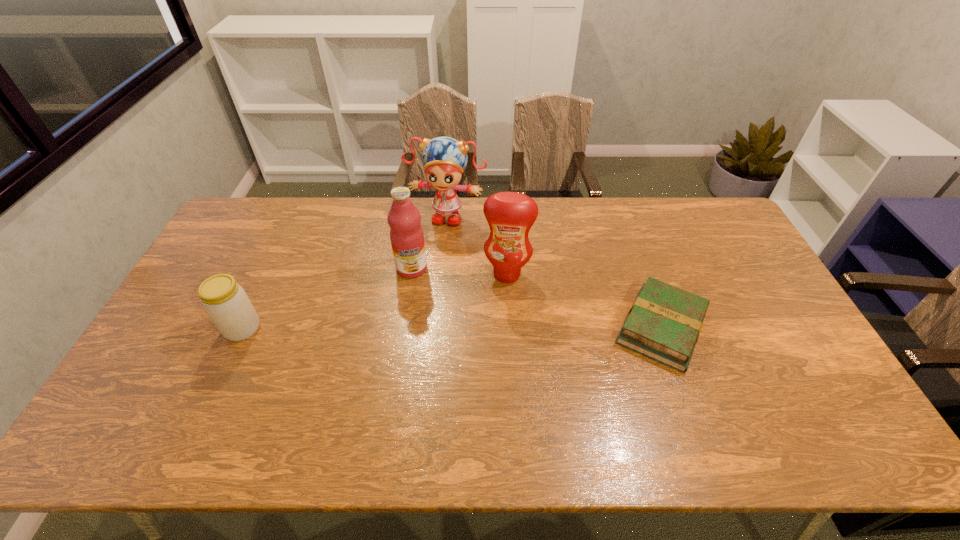
Where is `the fourth tallest object`? The width and height of the screenshot is (960, 540). the fourth tallest object is located at coordinates (226, 303).

Where is `jar`? Image resolution: width=960 pixels, height=540 pixels. jar is located at coordinates (226, 303).

The image size is (960, 540). What are the coordinates of `the rightmost object` in the screenshot? It's located at (664, 323).

Locate an element on the screen. The width and height of the screenshot is (960, 540). book is located at coordinates (664, 323).

What are the coordinates of `fruit juice` in the screenshot? It's located at (406, 234).

The width and height of the screenshot is (960, 540). I want to click on the farthest object, so click(444, 159).

I want to click on condiment, so point(510,215).

You are a GUI agent. You are given a task and a screenshot of the screen. Output one action in this format:
    pyautogui.click(x=<x>, y=<y>)
    Task: Click on the vacant region located 0.270m on the back of the jar
    The image size is (960, 540).
    Given the screenshot: What is the action you would take?
    pyautogui.click(x=278, y=252)

The width and height of the screenshot is (960, 540). What are the coordinates of `vacant position located 0.090m on the back of the shortest object` in the screenshot? It's located at (640, 268).

Image resolution: width=960 pixels, height=540 pixels. Find the location of `free space located on the label of the fruit juice`. free space located on the label of the fruit juice is located at coordinates (412, 321).